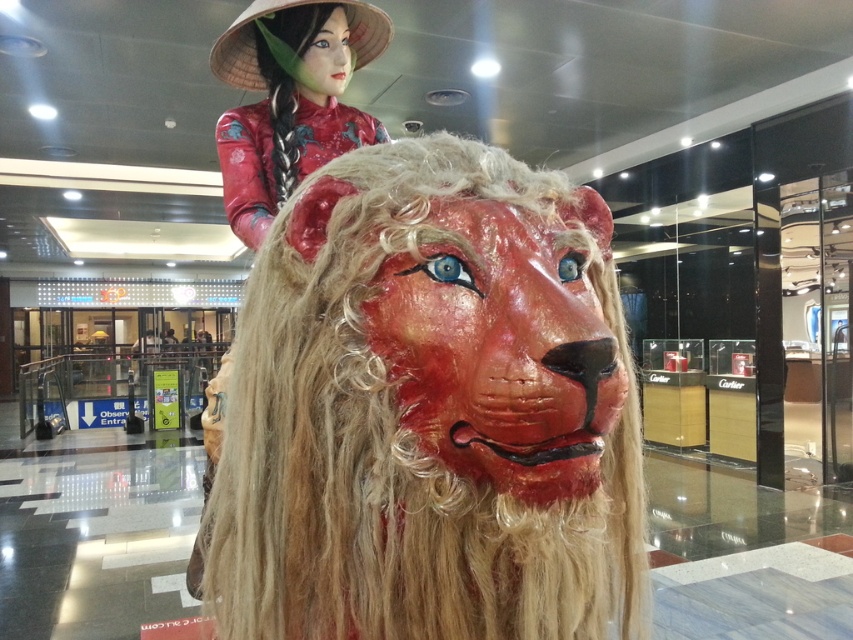
You are a photographer trying to capture both the matte red lion head at center and the matte red silk doll at upper center in a single frame. Given their heights, which object should you focus on first to ensure both are in the frame?

Since the matte red lion head at center is taller than the matte red silk doll at upper center, you should focus on the matte red lion head at center first to ensure its full height is captured within the frame.

You are a visitor in the mall and want to take a photo of the matte red lion head at center and the matte red silk doll at upper center. Which object should you focus on first if you want to capture both in a single frame without moving the camera?

The matte red lion head at center is below the matte red silk doll at upper center, so you should focus on the matte red silk doll at upper center first to ensure both are in the frame.

You are a visitor at the shopping mall and want to take a photo of the matte red lion head at center and the matte red silk doll at upper center. Which object should you focus on first if you want to capture both in the same frame without moving your camera?

The matte red lion head at center is wider than the matte red silk doll at upper center, so you should focus on the matte red lion head at center first to ensure both fit in the frame.